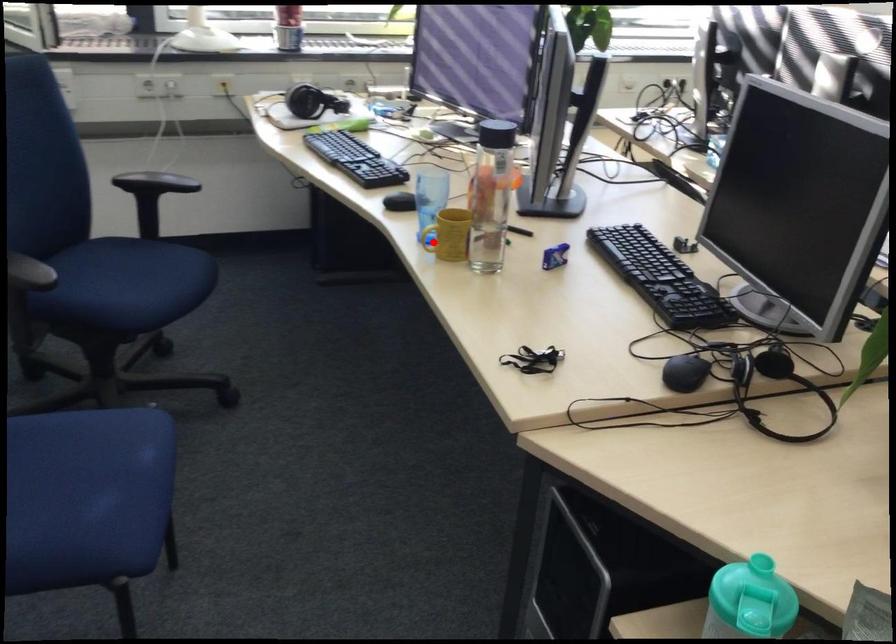
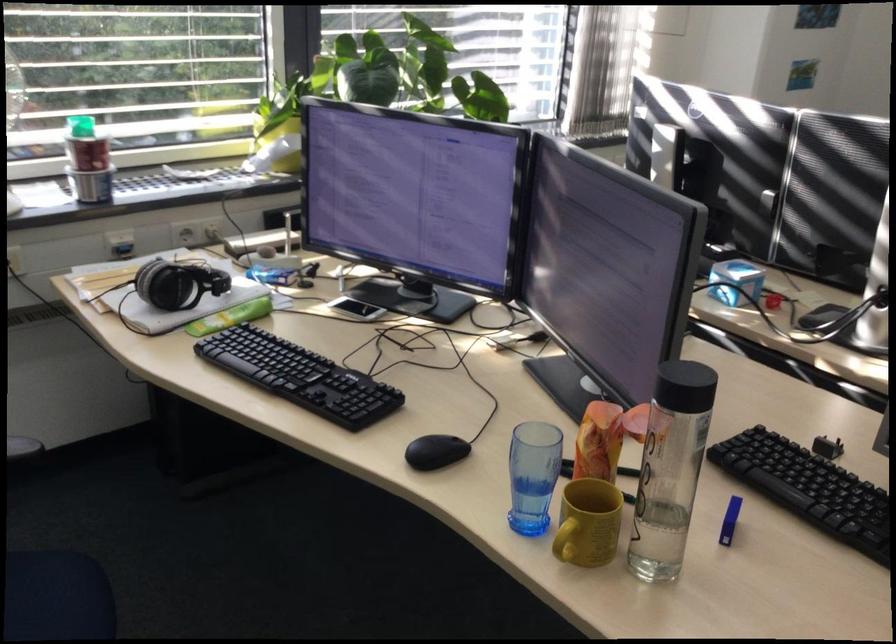
Question: I am providing you with two images of the same scene from different viewpoints. Given a red point in image1, look at the same physical point in image2. Is it:

Choices:
 (A) Closer to the viewpoint
 (B) Farther from the viewpoint

Answer: (A)